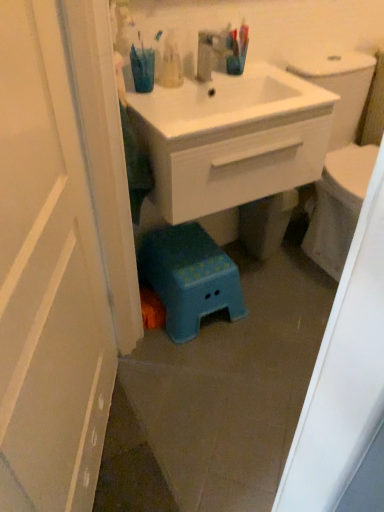
Question: From a real-world perspective, is white glossy door at left physically below translucent plastic toothbrushes at upper center?

Choices:
 (A) no
 (B) yes

Answer: (B)

Question: Does white glossy door at left have a greater height compared to translucent plastic toothbrushes at upper center?

Choices:
 (A) no
 (B) yes

Answer: (B)

Question: Is white glossy door at left further to the viewer compared to translucent plastic toothbrushes at upper center?

Choices:
 (A) no
 (B) yes

Answer: (A)

Question: From a real-world perspective, is white glossy door at left physically above translucent plastic toothbrushes at upper center?

Choices:
 (A) no
 (B) yes

Answer: (A)

Question: Can you confirm if white glossy door at left is shorter than translucent plastic toothbrushes at upper center?

Choices:
 (A) no
 (B) yes

Answer: (A)

Question: Relative to white glossy sink at center, is white glossy door at left in front or behind?

Choices:
 (A) front
 (B) behind

Answer: (A)

Question: Does point (36, 444) appear closer or farther from the camera than point (158, 96)?

Choices:
 (A) farther
 (B) closer

Answer: (B)

Question: From the image's perspective, is white glossy door at left located above or below white glossy sink at center?

Choices:
 (A) above
 (B) below

Answer: (B)

Question: Considering the positions of white glossy door at left and white glossy sink at center in the image, is white glossy door at left bigger or smaller than white glossy sink at center?

Choices:
 (A) big
 (B) small

Answer: (B)

Question: Is white glossy sink at center taller or shorter than blue plastic step stool at lower center?

Choices:
 (A) tall
 (B) short

Answer: (A)

Question: Is point (196, 110) positioned closer to the camera than point (173, 232)?

Choices:
 (A) farther
 (B) closer

Answer: (B)

Question: From a real-world perspective, is white glossy sink at center positioned above or below blue plastic step stool at lower center?

Choices:
 (A) below
 (B) above

Answer: (B)

Question: From the image's perspective, relative to blue plastic step stool at lower center, is white glossy sink at center above or below?

Choices:
 (A) above
 (B) below

Answer: (A)

Question: Do you think white glossy door at left is within blue plastic step stool at lower center, or outside of it?

Choices:
 (A) inside
 (B) outside

Answer: (B)

Question: Relative to blue plastic step stool at lower center, is white glossy door at left in front or behind?

Choices:
 (A) behind
 (B) front

Answer: (B)